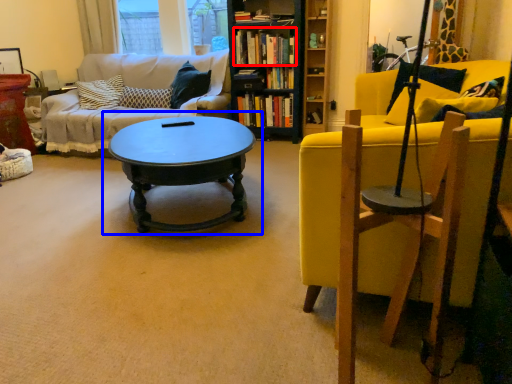
Question: Which point is further to the camera, book (highlighted by a red box) or coffee table (highlighted by a blue box)?

Choices:
 (A) book
 (B) coffee table

Answer: (A)